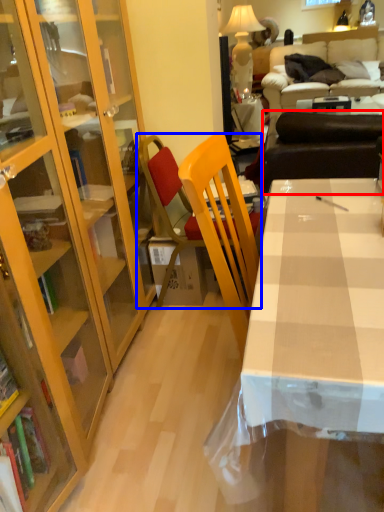
Question: Which object appears closest to the camera in this image, studio couch (highlighted by a red box) or chair (highlighted by a blue box)?

Choices:
 (A) studio couch
 (B) chair

Answer: (B)